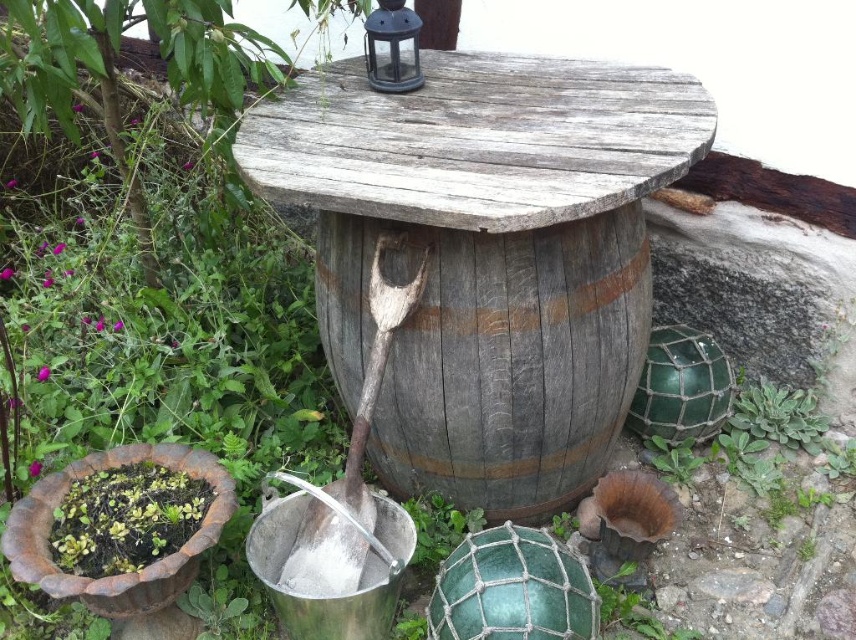
Who is more distant from viewer, (434, 400) or (307, 548)?

Point (307, 548)

Measure the distance from weathered wood barrel at center to wooden shovel at center.

12.51 inches

This screenshot has height=640, width=856. I want to click on weathered wood barrel at center, so click(x=492, y=353).